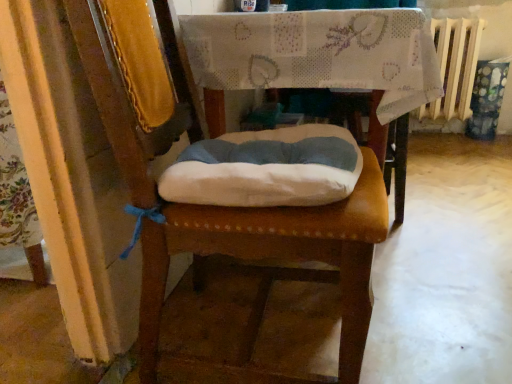
Question: Is leather cushion at center bigger or smaller than fabric-covered table at center?

Choices:
 (A) small
 (B) big

Answer: (A)

Question: Is leather cushion at center taller or shorter than fabric-covered table at center?

Choices:
 (A) short
 (B) tall

Answer: (B)

Question: Which object is the closest to the fabric-covered table at center?

Choices:
 (A) leather cushion at center
 (B) white painted metal radiator at upper right

Answer: (A)

Question: Which object is the farthest from the fabric-covered table at center?

Choices:
 (A) white painted metal radiator at upper right
 (B) leather cushion at center

Answer: (A)